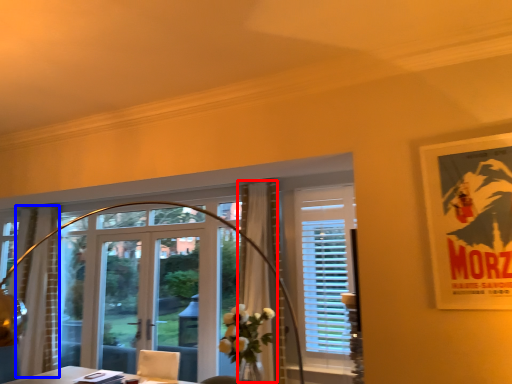
Question: Among these objects, which one is nearest to the camera, curtain (highlighted by a red box) or curtain (highlighted by a blue box)?

Choices:
 (A) curtain
 (B) curtain

Answer: (A)